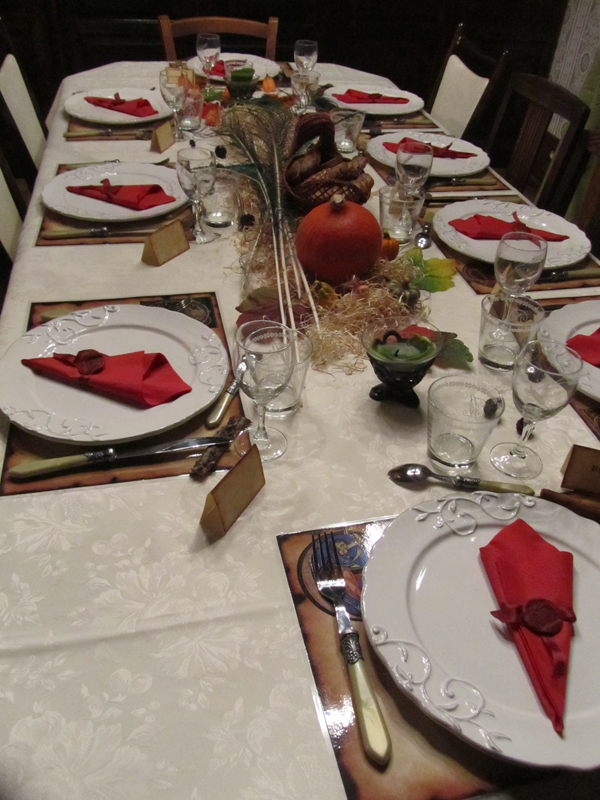
Image resolution: width=600 pixels, height=800 pixels. What are the coordinates of `chairs` in the screenshot? It's located at (562, 106), (452, 90), (229, 24), (26, 113), (8, 214), (589, 213).